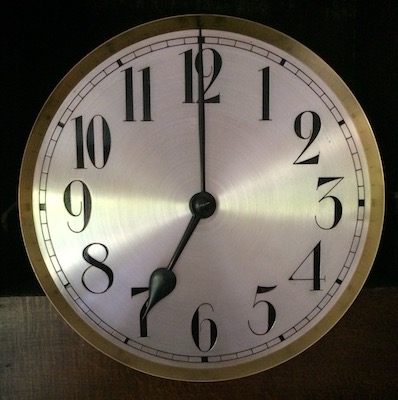
Find the location of `wood grain in the background of picture`. wood grain in the background of picture is located at coordinates (37, 348).